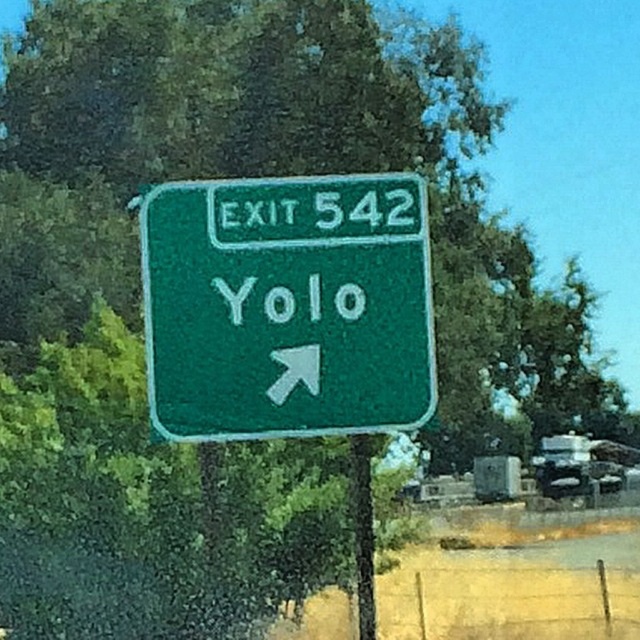
Does green textured sign at center have a greater height compared to green painted metal pole at center?

Indeed, green textured sign at center has a greater height compared to green painted metal pole at center.

Does green textured sign at center lie behind green painted metal pole at center?

No, it is not.

Is point (420, 305) in front of point (356, 616)?

Yes, it is in front of point (356, 616).

Image resolution: width=640 pixels, height=640 pixels. Find the location of `green textured sign at center`. green textured sign at center is located at coordinates (288, 307).